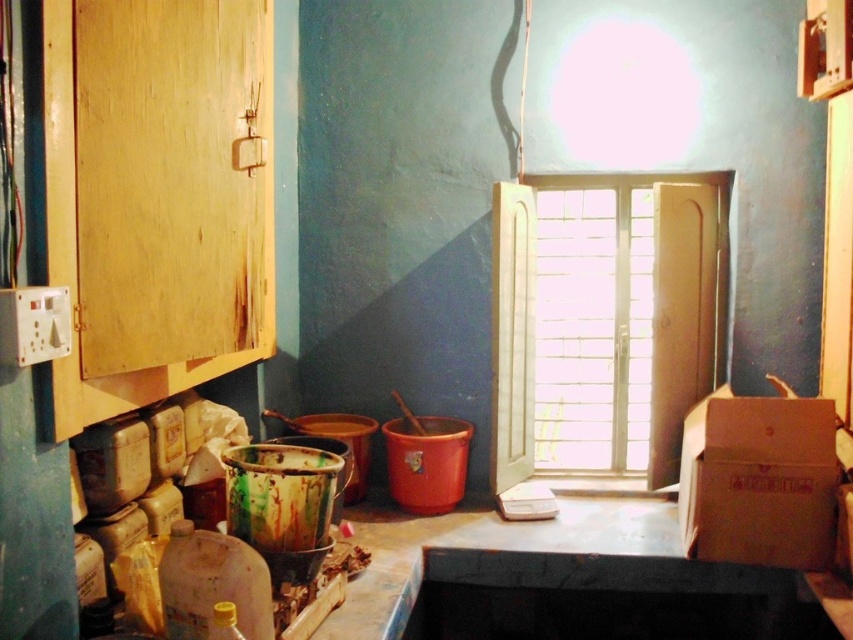
Is wooden window at center taller than brown cardboard box at right?

Yes, wooden window at center is taller than brown cardboard box at right.

Is point (637, 268) farther from viewer compared to point (767, 493)?

Yes, it is behind point (767, 493).

Between point (526, 388) and point (688, 509), which one is positioned behind?

Point (526, 388)

At what (x,y) coordinates should I click in order to perform the action: click on wooden window at center. Please return your answer as a coordinate pair (x, y). Looking at the image, I should click on (604, 321).